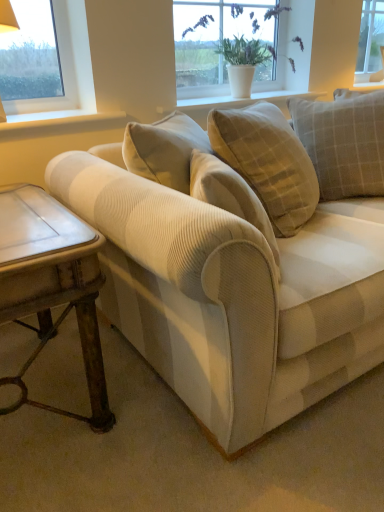
Image resolution: width=384 pixels, height=512 pixels. Identify the location of white wood at upper center, which is the 1th window sill from front to back. (62, 126).

What do you see at coordinates (244, 100) in the screenshot? Image resolution: width=384 pixels, height=512 pixels. I see `white textured vase at upper center, positioned as the 2th window sill in front-to-back order` at bounding box center [244, 100].

Measure the distance between point (290, 207) and camera.

Point (290, 207) and camera are 1.54 meters apart.

What is the approximate height of beige corduroy pillow at center, positioned as the 2th pillow in right-to-left order?

It is 24.49 inches.

Image resolution: width=384 pixels, height=512 pixels. Describe the element at coordinates (221, 44) in the screenshot. I see `white ceramic pot at upper center, which is counted as the 2th window, starting from the back` at that location.

Image resolution: width=384 pixels, height=512 pixels. Describe the element at coordinates (52, 284) in the screenshot. I see `rustic wood side table at lower left` at that location.

Describe the element at coordinates (231, 272) in the screenshot. I see `beige corduroy couch at center` at that location.

Image resolution: width=384 pixels, height=512 pixels. Identify the location of clear glass window at upper right, the first window viewed from the back. (370, 41).

Image resolution: width=384 pixels, height=512 pixels. Identify the location of white wood at upper center, the second window sill when ordered from top to bottom. (62, 126).

Is rustic wood side table at lower left wider or thinner than light beige corduroy pillow at upper right, which is the 1th pillow from right to left?

Considering their sizes, rustic wood side table at lower left looks broader than light beige corduroy pillow at upper right, which is the 1th pillow from right to left.

Consider the image. Is rustic wood side table at lower left oriented towards light beige corduroy pillow at upper right, which is the 1th pillow from right to left?

No.

In terms of size, does rustic wood side table at lower left appear bigger or smaller than light beige corduroy pillow at upper right, the 2th pillow viewed from the left?

In the image, rustic wood side table at lower left appears to be larger than light beige corduroy pillow at upper right, the 2th pillow viewed from the left.

From a real-world perspective, relative to light beige corduroy pillow at upper right, which is the 1th pillow from right to left, is rustic wood side table at lower left vertically above or below?

Clearly, from a real-world perspective, rustic wood side table at lower left is below light beige corduroy pillow at upper right, which is the 1th pillow from right to left.

Can you tell me how much white textured vase at upper center, positioned as the first window sill in back-to-front order, and light beige corduroy pillow at upper right, which is the 1th pillow from right to left, differ in facing direction?

The angle between the facing direction of white textured vase at upper center, positioned as the first window sill in back-to-front order, and the facing direction of light beige corduroy pillow at upper right, which is the 1th pillow from right to left, is 38.3 degrees.

Between point (257, 93) and point (334, 182), which one is positioned in front?

Point (334, 182)

Considering the sizes of objects white textured vase at upper center, which is the first window sill in right-to-left order, and light beige corduroy pillow at upper right, which is the 1th pillow from right to left, in the image provided, who is bigger, white textured vase at upper center, which is the first window sill in right-to-left order, or light beige corduroy pillow at upper right, which is the 1th pillow from right to left,?

Bigger between the two is light beige corduroy pillow at upper right, which is the 1th pillow from right to left.

Between white textured vase at upper center, which is the second window sill from bottom to top, and light beige corduroy pillow at upper right, the 2th pillow viewed from the left, which one has smaller width?

With smaller width is white textured vase at upper center, which is the second window sill from bottom to top.

Is clear glass window at upper right, the first window viewed from the back, directly adjacent to white ceramic pot at upper center, the first window from the front?

clear glass window at upper right, the first window viewed from the back, and white ceramic pot at upper center, the first window from the front, are not in contact.

Where is `window that appears in front of the clear glass window at upper right, positioned as the 1th window in right-to-left order`? This screenshot has height=512, width=384. window that appears in front of the clear glass window at upper right, positioned as the 1th window in right-to-left order is located at coordinates (221, 44).

Considering the positions of points (383, 13) and (297, 66), is point (383, 13) closer to camera compared to point (297, 66)?

No, it is behind (297, 66).

Is beige corduroy pillow at center, positioned as the 2th pillow in right-to-left order, taller or shorter than white wood at upper center, the first window sill when ordered from left to right?

beige corduroy pillow at center, positioned as the 2th pillow in right-to-left order, is taller than white wood at upper center, the first window sill when ordered from left to right.

Identify the location of pillow located in front of the white wood at upper center, which is the 1th window sill from front to back. click(268, 162).

From the image's perspective, does beige corduroy pillow at center, marked as the first pillow in a left-to-right arrangement, appear higher than white wood at upper center, which is the 1th window sill from front to back?

No, from the image's perspective, beige corduroy pillow at center, marked as the first pillow in a left-to-right arrangement, is not above white wood at upper center, which is the 1th window sill from front to back.

Which object is further away from the camera, beige corduroy pillow at center, marked as the first pillow in a left-to-right arrangement, or white wood at upper center, which is the 1th window sill from front to back?

white wood at upper center, which is the 1th window sill from front to back, is more distant.

Are light beige corduroy pillow at upper right, which is the 1th pillow from right to left, and rustic wood side table at lower left beside each other?

No, light beige corduroy pillow at upper right, which is the 1th pillow from right to left, is not in contact with rustic wood side table at lower left.

Would you say light beige corduroy pillow at upper right, which is the 1th pillow from right to left, contains rustic wood side table at lower left?

Actually, rustic wood side table at lower left is outside light beige corduroy pillow at upper right, which is the 1th pillow from right to left.

From a real-world perspective, does light beige corduroy pillow at upper right, the 2th pillow viewed from the left, sit lower than rustic wood side table at lower left?

Incorrect, from a real-world perspective, light beige corduroy pillow at upper right, the 2th pillow viewed from the left, is higher than rustic wood side table at lower left.

Which of these two, light beige corduroy pillow at upper right, which is the 1th pillow from right to left, or rustic wood side table at lower left, is bigger?

With larger size is rustic wood side table at lower left.

Which is nearer, (323,160) or (330,241)?

Point (323,160) is farther from the camera than point (330,241).

Is light beige corduroy pillow at upper right, the 2th pillow viewed from the left, in front of or behind beige corduroy couch at center in the image?

light beige corduroy pillow at upper right, the 2th pillow viewed from the left, is positioned farther from the viewer than beige corduroy couch at center.

From the image's perspective, which one is positioned higher, light beige corduroy pillow at upper right, the 2th pillow viewed from the left, or beige corduroy couch at center?

light beige corduroy pillow at upper right, the 2th pillow viewed from the left, appears higher in the image.

Does light beige corduroy pillow at upper right, which is the 1th pillow from right to left, come in front of white textured vase at upper center, positioned as the first window sill in back-to-front order?

Yes, the depth of light beige corduroy pillow at upper right, which is the 1th pillow from right to left, is less than that of white textured vase at upper center, positioned as the first window sill in back-to-front order.

From the image's perspective, relative to white textured vase at upper center, positioned as the 2th window sill in front-to-back order, is light beige corduroy pillow at upper right, which is the 1th pillow from right to left, above or below?

Based on their image positions, light beige corduroy pillow at upper right, which is the 1th pillow from right to left, is located beneath white textured vase at upper center, positioned as the 2th window sill in front-to-back order.

Between light beige corduroy pillow at upper right, the 2th pillow viewed from the left, and white textured vase at upper center, arranged as the 1th window sill when viewed from the top, which one has smaller size?

white textured vase at upper center, arranged as the 1th window sill when viewed from the top.

Consider the image. Does light beige corduroy pillow at upper right, the 2th pillow viewed from the left, have a greater height compared to white textured vase at upper center, positioned as the 2th window sill in front-to-back order?

Indeed, light beige corduroy pillow at upper right, the 2th pillow viewed from the left, has a greater height compared to white textured vase at upper center, positioned as the 2th window sill in front-to-back order.

Identify the location of table located underneath the light beige corduroy pillow at upper right, the 2th pillow viewed from the left (from a real-world perspective). The image size is (384, 512). (52, 284).

Identify the location of window sill behind the light beige corduroy pillow at upper right, which is the 1th pillow from right to left. (244, 100).

Which object lies nearer to the anchor point beige corduroy couch at center, white textured vase at upper center, positioned as the 2th window sill in front-to-back order, or white wood at upper center, the second window sill when ordered from top to bottom?

The object closer to beige corduroy couch at center is white wood at upper center, the second window sill when ordered from top to bottom.

Which object lies nearer to the anchor point rustic wood side table at lower left, white ceramic pot at upper center, which is counted as the 2th window, starting from the back, or beige corduroy pillow at center, positioned as the 2th pillow in right-to-left order?

Based on the image, beige corduroy pillow at center, positioned as the 2th pillow in right-to-left order, appears to be nearer to rustic wood side table at lower left.

When comparing their distances from white textured vase at upper center, the second window sill positioned from the left, does beige corduroy couch at center or rustic wood side table at lower left seem further?

The object further to white textured vase at upper center, the second window sill positioned from the left, is rustic wood side table at lower left.

Considering their positions, is white wood at upper center, which is the 1th window sill from front to back, positioned further to light beige corduroy pillow at upper right, which is the 1th pillow from right to left, than white textured vase at upper center, positioned as the 2th window sill in front-to-back order?

Among the two, white wood at upper center, which is the 1th window sill from front to back, is located further to light beige corduroy pillow at upper right, which is the 1th pillow from right to left.

When comparing their distances from white textured vase at upper center, arranged as the 1th window sill when viewed from the top, does beige corduroy couch at center or beige corduroy pillow at center, marked as the first pillow in a left-to-right arrangement, seem closer?

Based on the image, beige corduroy pillow at center, marked as the first pillow in a left-to-right arrangement, appears to be nearer to white textured vase at upper center, arranged as the 1th window sill when viewed from the top.

Consider the image. When comparing their distances from beige corduroy pillow at center, positioned as the 2th pillow in right-to-left order, does light beige corduroy pillow at upper right, which is the 1th pillow from right to left, or rustic wood side table at lower left seem further?

The object further to beige corduroy pillow at center, positioned as the 2th pillow in right-to-left order, is rustic wood side table at lower left.

Based on their spatial positions, is white ceramic pot at upper center, which is counted as the 2th window, starting from the back, or clear glass window at upper right, which ranks as the second window in left-to-right order, further from white textured vase at upper center, positioned as the 2th window sill in front-to-back order?

clear glass window at upper right, which ranks as the second window in left-to-right order, is further to white textured vase at upper center, positioned as the 2th window sill in front-to-back order.

Considering their positions, is clear glass window at upper right, which ranks as the second window in left-to-right order, positioned closer to beige corduroy couch at center than white textured vase at upper center, the second window sill positioned from the left?

Based on the image, white textured vase at upper center, the second window sill positioned from the left, appears to be nearer to beige corduroy couch at center.

Image resolution: width=384 pixels, height=512 pixels. Find the location of `pillow located between beige corduroy pillow at center, positioned as the 2th pillow in right-to-left order, and white textured vase at upper center, positioned as the 2th window sill in front-to-back order, in the depth direction`. pillow located between beige corduroy pillow at center, positioned as the 2th pillow in right-to-left order, and white textured vase at upper center, positioned as the 2th window sill in front-to-back order, in the depth direction is located at coordinates (343, 142).

Where is `pillow between beige corduroy couch at center and light beige corduroy pillow at upper right, which is the 1th pillow from right to left, from front to back`? This screenshot has width=384, height=512. pillow between beige corduroy couch at center and light beige corduroy pillow at upper right, which is the 1th pillow from right to left, from front to back is located at coordinates click(x=268, y=162).

Identify the location of studio couch located between white wood at upper center, the first window sill when ordered from left to right, and light beige corduroy pillow at upper right, which is the 1th pillow from right to left, in the left-right direction. The width and height of the screenshot is (384, 512). (231, 272).

What are the coordinates of `window sill situated between white wood at upper center, which appears as the 2th window sill when viewed from the right, and clear glass window at upper right, positioned as the 1th window in right-to-left order, from left to right` in the screenshot? It's located at (244, 100).